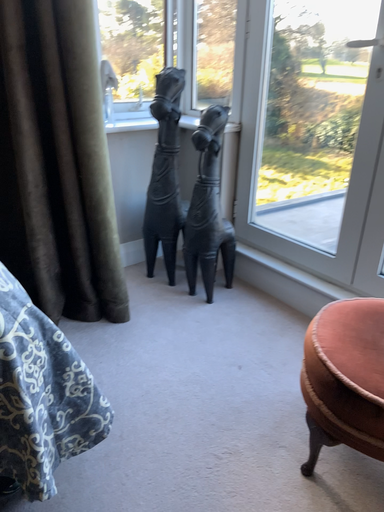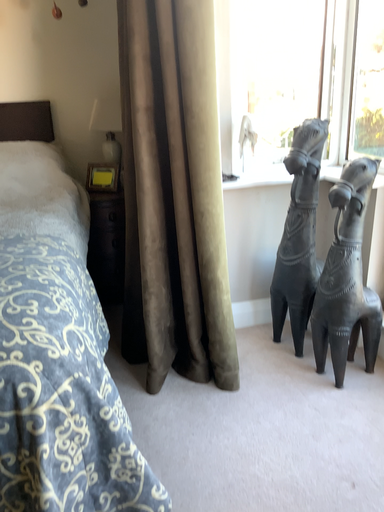
Question: Which way did the camera rotate in the video?

Choices:
 (A) rotated right
 (B) rotated left

Answer: (B)